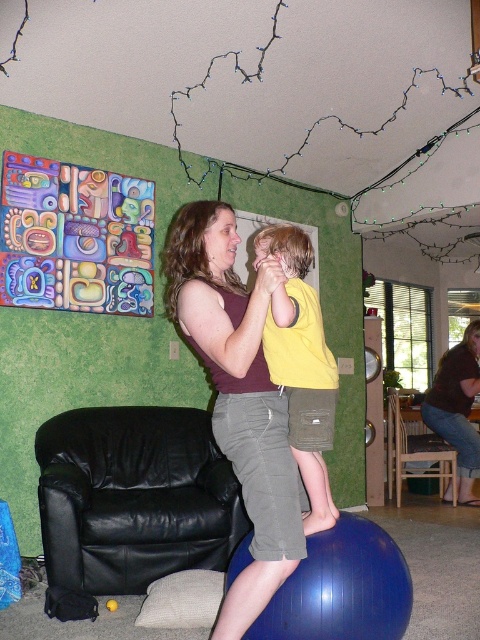
Question: Which object is the farthest from the matte purple tank top at center?

Choices:
 (A) black leather armchair at left
 (B) yellow matte shirt at center
 (C) matte brown shirt at center

Answer: (C)

Question: Is matte brown shirt at center behind brown wooden chair at lower right?

Choices:
 (A) no
 (B) yes

Answer: (A)

Question: Can you confirm if yellow matte shirt at center is bigger than matte brown shirt at center?

Choices:
 (A) no
 (B) yes

Answer: (A)

Question: Observing the image, what is the correct spatial positioning of black leather armchair at left in reference to yellow matte shirt at center?

Choices:
 (A) right
 (B) left

Answer: (B)

Question: Which point is closer to the camera?

Choices:
 (A) brown wooden chair at lower right
 (B) black leather armchair at left
 (C) yellow matte shirt at center

Answer: (C)

Question: Which is farther from the matte purple tank top at center?

Choices:
 (A) matte brown shirt at center
 (B) black leather armchair at left

Answer: (A)